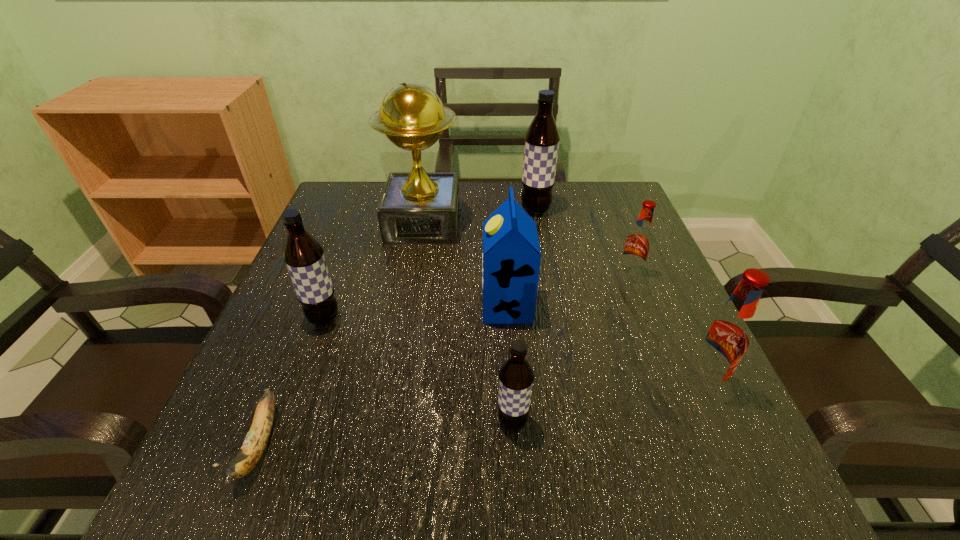
You are a GUI agent. You are given a task and a screenshot of the screen. Output one action in this format:
    pyautogui.click(x=<x>, y=<y>)
    Task: Click on the vacant space situated on the right of the third farthest root beer
    This screenshot has width=960, height=540.
    Given the screenshot: What is the action you would take?
    pyautogui.click(x=547, y=318)

Where is `vacant space situated 0.060m on the front of the smaller red root beer`? Image resolution: width=960 pixels, height=540 pixels. vacant space situated 0.060m on the front of the smaller red root beer is located at coordinates (640, 301).

Image resolution: width=960 pixels, height=540 pixels. I want to click on vacant space situated 0.270m on the back of the smallest brown root beer, so click(505, 293).

The image size is (960, 540). In order to click on award at the far edge in this screenshot , I will do `click(418, 207)`.

Where is `root beer situated at the far edge`? This screenshot has width=960, height=540. root beer situated at the far edge is located at coordinates (542, 138).

In order to click on object present at the near edge in this screenshot , I will do `click(253, 447)`.

The height and width of the screenshot is (540, 960). In order to click on root beer that is at the left edge in this screenshot , I will do `click(303, 255)`.

Find the location of `banana present at the left edge`. banana present at the left edge is located at coordinates (253, 447).

Find the location of `object present at the near left corner`. object present at the near left corner is located at coordinates (253, 447).

The width and height of the screenshot is (960, 540). I want to click on free spot at the left edge of the desktop, so click(336, 281).